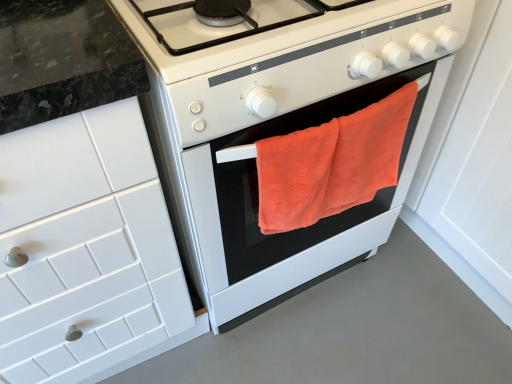
Question: Can you confirm if white tile cabinet at left is smaller than orange towel at center?

Choices:
 (A) yes
 (B) no

Answer: (B)

Question: Considering the relative positions of white tile cabinet at left and orange towel at center in the image provided, is white tile cabinet at left to the left of orange towel at center from the viewer's perspective?

Choices:
 (A) no
 (B) yes

Answer: (B)

Question: Can you confirm if white tile cabinet at left is positioned to the right of orange towel at center?

Choices:
 (A) no
 (B) yes

Answer: (A)

Question: Can you confirm if white tile cabinet at left is taller than orange towel at center?

Choices:
 (A) yes
 (B) no

Answer: (A)

Question: Is white tile cabinet at left wider than orange towel at center?

Choices:
 (A) yes
 (B) no

Answer: (B)

Question: In the image, is orange towel at center on the left side or the right side of orange terry cloth towel at center?

Choices:
 (A) right
 (B) left

Answer: (B)

Question: From their relative heights in the image, would you say orange towel at center is taller or shorter than orange terry cloth towel at center?

Choices:
 (A) short
 (B) tall

Answer: (B)

Question: Relative to orange terry cloth towel at center, is orange towel at center in front or behind?

Choices:
 (A) front
 (B) behind

Answer: (A)

Question: From the image's perspective, relative to orange terry cloth towel at center, is orange towel at center above or below?

Choices:
 (A) above
 (B) below

Answer: (A)

Question: Is orange terry cloth towel at center to the left or to the right of orange towel at center in the image?

Choices:
 (A) right
 (B) left

Answer: (A)

Question: Considering their positions, is orange terry cloth towel at center located in front of or behind orange towel at center?

Choices:
 (A) behind
 (B) front

Answer: (A)

Question: Is orange terry cloth towel at center inside the boundaries of orange towel at center, or outside?

Choices:
 (A) outside
 (B) inside

Answer: (B)

Question: Based on their sizes in the image, would you say orange terry cloth towel at center is bigger or smaller than orange towel at center?

Choices:
 (A) small
 (B) big

Answer: (A)

Question: Considering the positions of orange terry cloth towel at center and white tile cabinet at left in the image, is orange terry cloth towel at center wider or thinner than white tile cabinet at left?

Choices:
 (A) thin
 (B) wide

Answer: (A)

Question: Is orange terry cloth towel at center to the left or to the right of white tile cabinet at left in the image?

Choices:
 (A) right
 (B) left

Answer: (A)